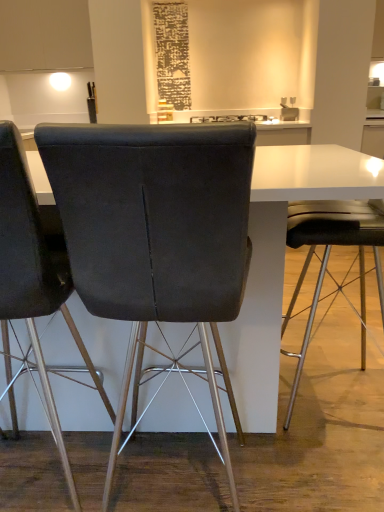
Identify the location of free space on the front side of matte black chair at right, the 1th chair positioned from the right. (330, 463).